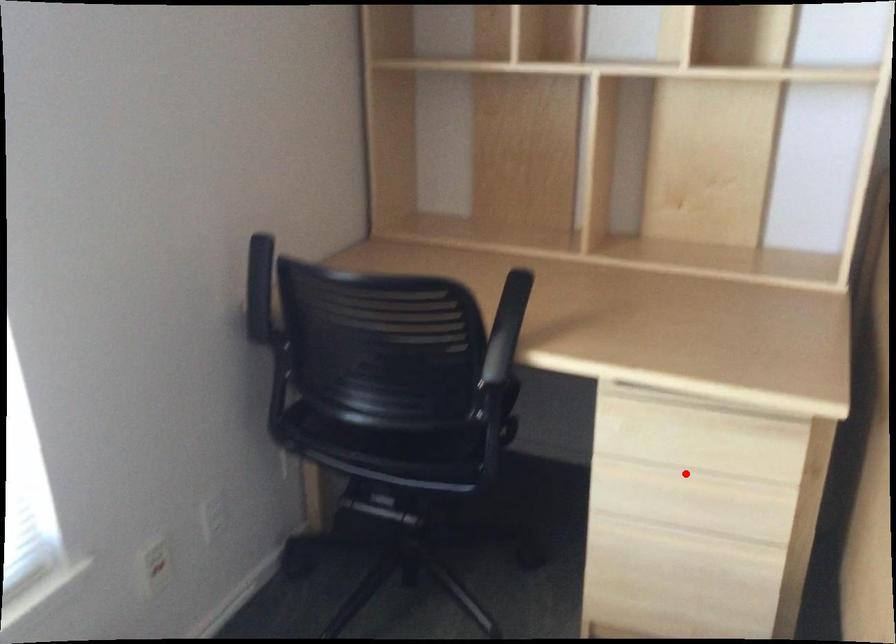
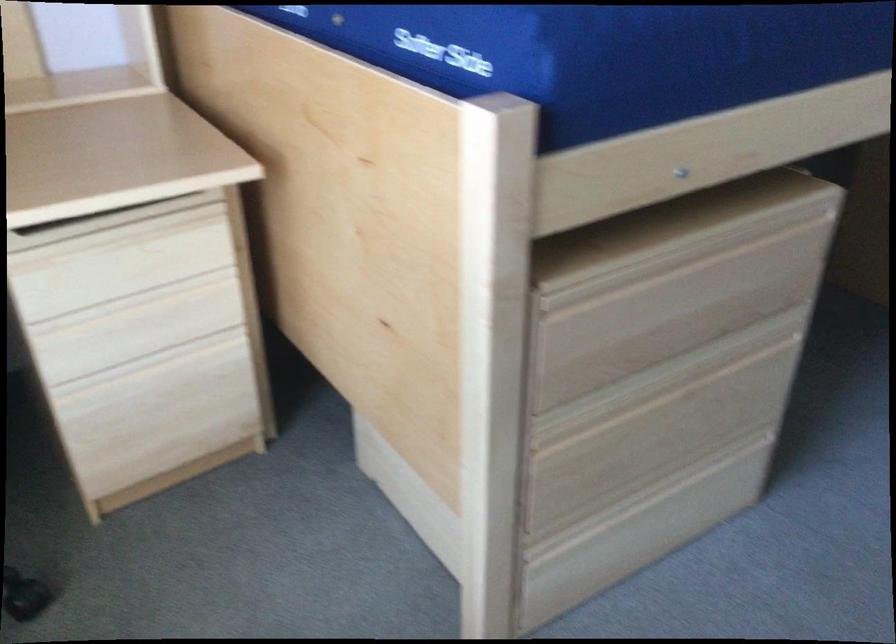
Locate, in the second image, the point that corresponds to the highlighted location in the first image.

(134, 301)